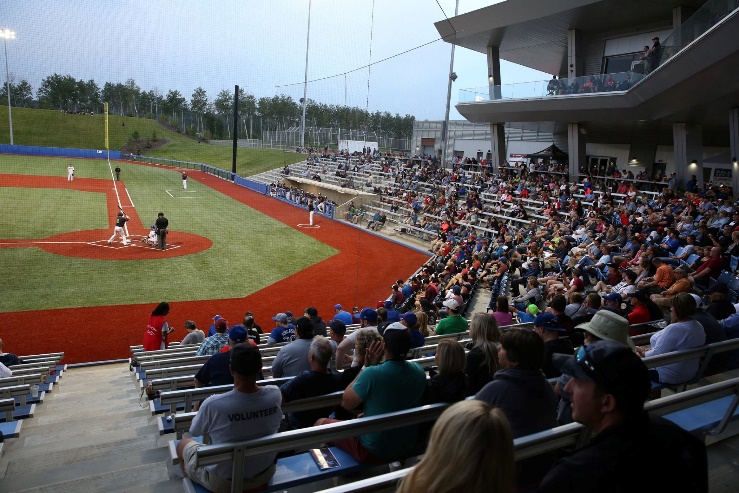
The height and width of the screenshot is (493, 739). I want to click on seats, so click(x=162, y=381), click(x=154, y=350), click(x=171, y=361), click(x=180, y=412).